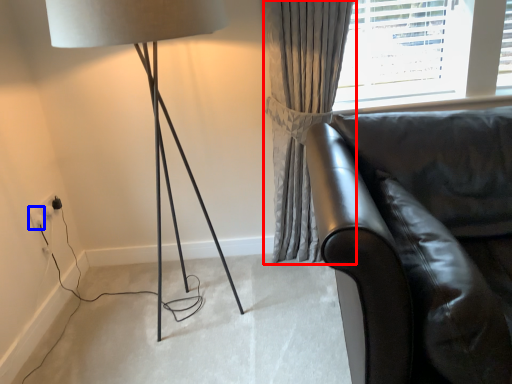
Question: Which object appears closest to the camera in this image, curtain (highlighted by a red box) or electric outlet (highlighted by a blue box)?

Choices:
 (A) curtain
 (B) electric outlet

Answer: (A)